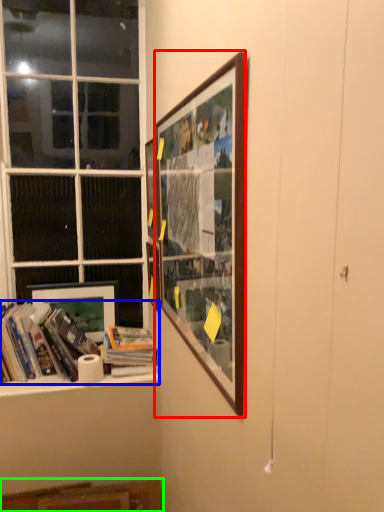
Question: Which object is positioned closest to picture frame (highlighted by a red box)? Select from book (highlighted by a blue box) and cabinet (highlighted by a green box).

Choices:
 (A) book
 (B) cabinet

Answer: (A)